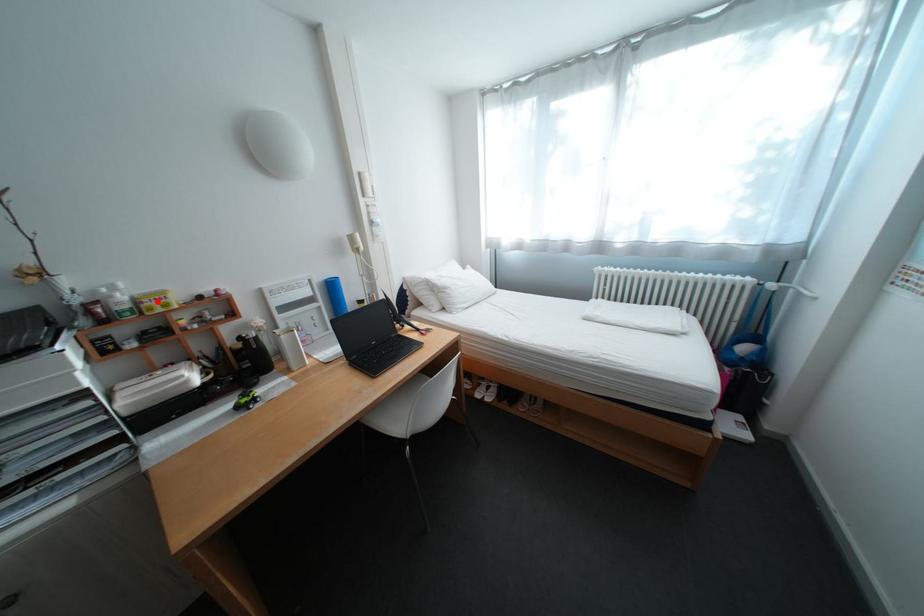
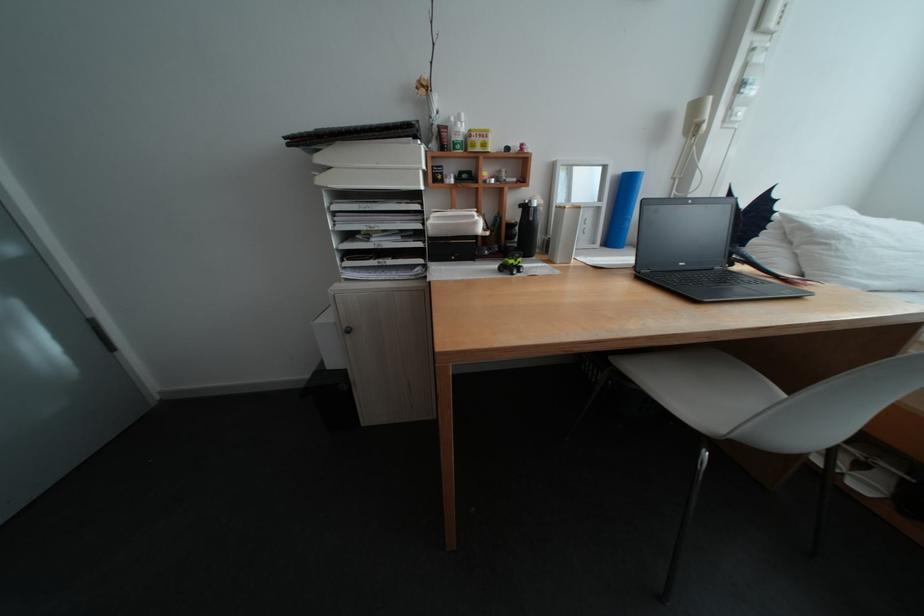
Question: I am providing you with two images of the same scene from different viewpoints. Given a red point in image1, look at the same physical point in image2. Is it:

Choices:
 (A) Closer to the viewpoint
 (B) Farther from the viewpoint

Answer: (A)